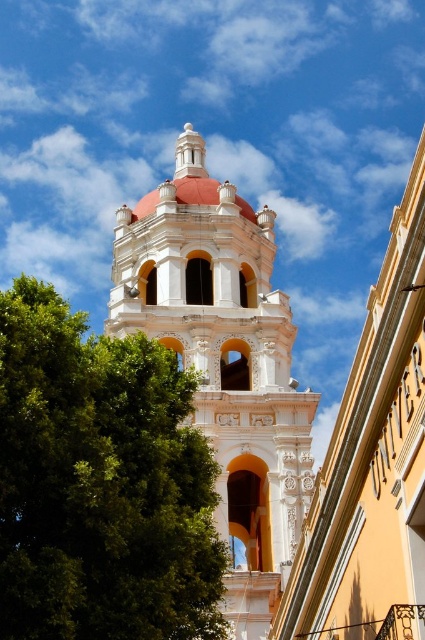
Between point (39, 529) and point (224, 417), which one is positioned in front?

Point (39, 529) is more forward.

You are a GUI agent. You are given a task and a screenshot of the screen. Output one action in this format:
    pyautogui.click(x=<x>, y=<y>)
    Task: Click on the green leafy tree at left
    
    Given the screenshot: What is the action you would take?
    pyautogui.click(x=99, y=483)

Is point (36, 404) farther from viewer compared to point (362, 460)?

No, it is not.

Can you confirm if green leafy tree at left is shorter than white ornate tower at center?

Correct, green leafy tree at left is not as tall as white ornate tower at center.

Which is in front, point (5, 337) or point (320, 502)?

Positioned in front is point (5, 337).

This screenshot has width=425, height=640. In order to click on green leafy tree at left in this screenshot , I will do point(99,483).

Is point (149, 300) positioned before point (387, 308)?

No.

Who is positioned more to the left, white stucco tower at center or white ornate tower at center?

Positioned to the left is white stucco tower at center.

Image resolution: width=425 pixels, height=640 pixels. Describe the element at coordinates (224, 362) in the screenshot. I see `white stucco tower at center` at that location.

Locate an element on the screen. white stucco tower at center is located at coordinates pos(224,362).